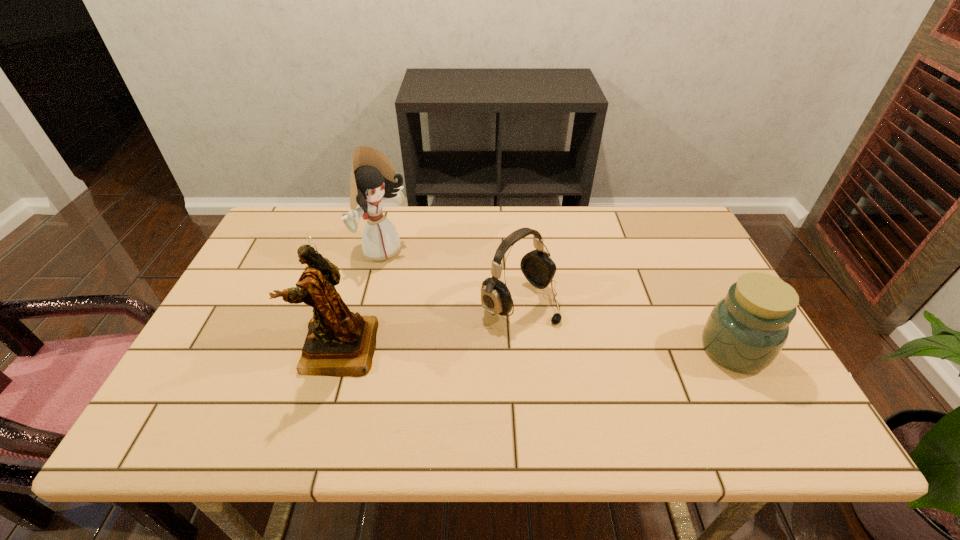
Locate an element on the screen. This screenshot has height=540, width=960. free spot on the desktop that is between the figurine and the rightmost object and is positioned at the front face of the farthest object is located at coordinates (535, 349).

Where is `free space on the desktop that is between the figurine and the jar and is positioned with the microphone on the side of the headset`? This screenshot has height=540, width=960. free space on the desktop that is between the figurine and the jar and is positioned with the microphone on the side of the headset is located at coordinates (583, 349).